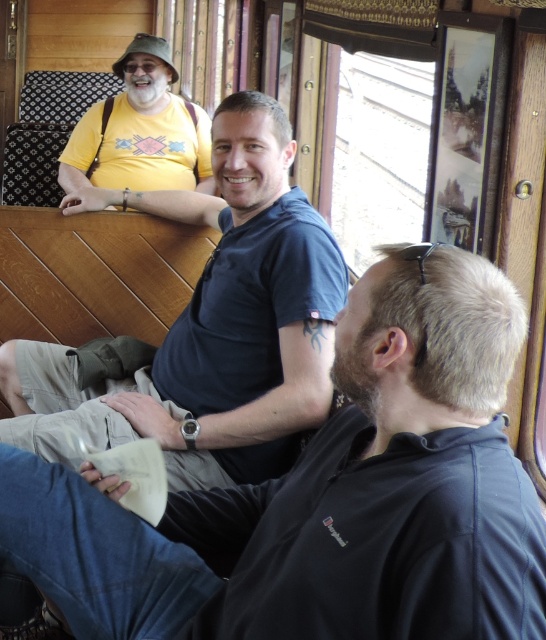
Is blue cotton shirt at center further to the viewer compared to yellow matte shirt at upper left?

That is False.

Does blue cotton shirt at center have a larger size compared to yellow matte shirt at upper left?

Indeed, blue cotton shirt at center has a larger size compared to yellow matte shirt at upper left.

Between point (122, 406) and point (99, 129), which one is positioned behind?

Point (99, 129)

What are the coordinates of `blue cotton shirt at center` in the screenshot? It's located at (204, 326).

Who is positioned more to the left, black matte shirt at center or yellow matte shirt at upper left?

yellow matte shirt at upper left is more to the left.

Based on the photo, which is more to the right, black matte shirt at center or yellow matte shirt at upper left?

black matte shirt at center

Between point (109, 624) and point (164, 134), which one is positioned behind?

The point (164, 134) is behind.

Find the location of `black matte shirt at center`. black matte shirt at center is located at coordinates (328, 496).

From the picture: Can you confirm if black matte shirt at center is shorter than blue cotton shirt at center?

Correct, black matte shirt at center is not as tall as blue cotton shirt at center.

Between point (311, 576) and point (176, 360), which one is positioned in front?

Point (311, 576)

Identify the location of black matte shirt at center. The image size is (546, 640). (328, 496).